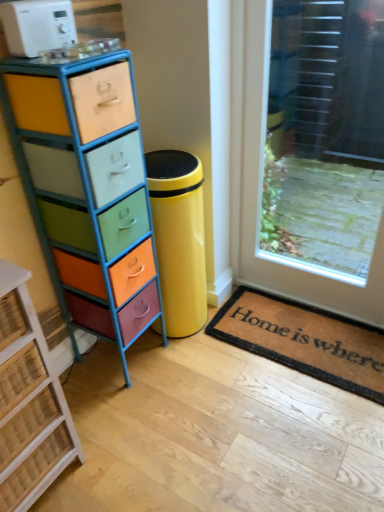
The height and width of the screenshot is (512, 384). In order to click on vacant area that lies in front of transparent glass door at upper right in this screenshot , I will do `click(287, 402)`.